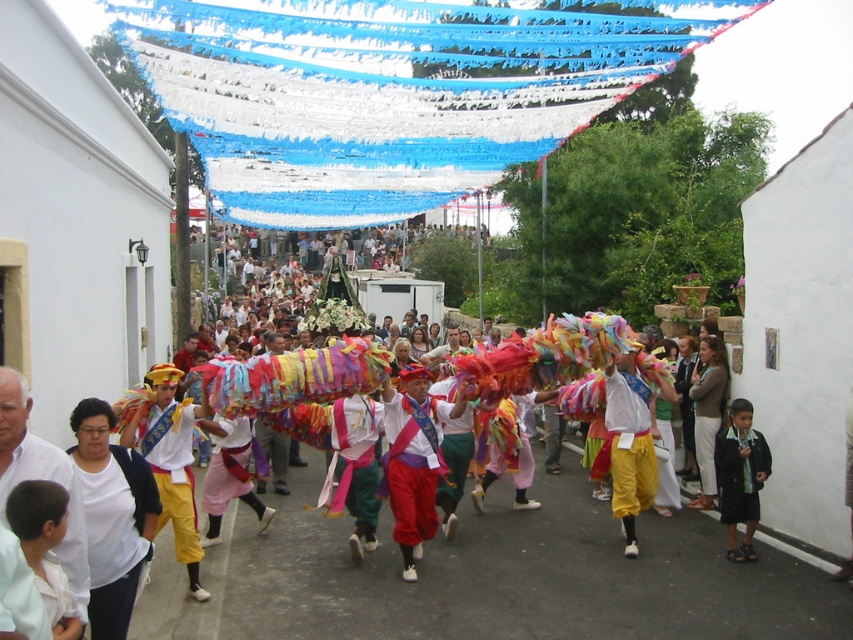
You are a photographer trying to capture the vibrant festival scene. You notice the white cotton shirt at lower left and the dark blue fabric at lower right. Which object should you focus on first if you want to include both in your shot without moving the camera?

The white cotton shirt at lower left should be focused on first because it is in front of the dark blue fabric at lower right, ensuring both can be captured clearly in the frame.

You are a photographer standing in the crowd at the festival. You want to take a photo that includes both the point at coordinates point (654, 592) and point (77, 460). Which point should you focus on first to ensure both are in the frame?

You should focus on point (77, 460) first because it is closer to you than point (654, 592), which is further away. By focusing on the closer point, the depth of field may help keep both points in focus.